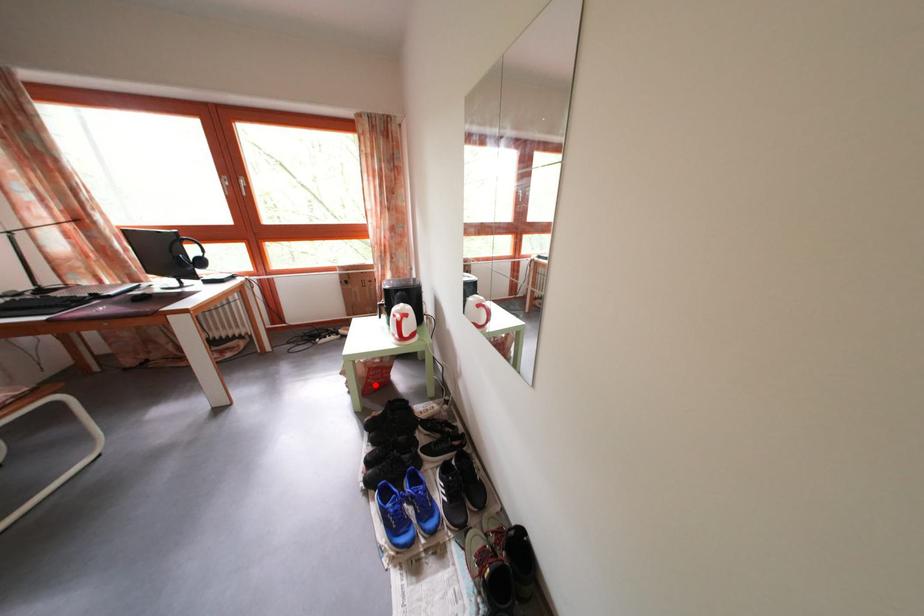
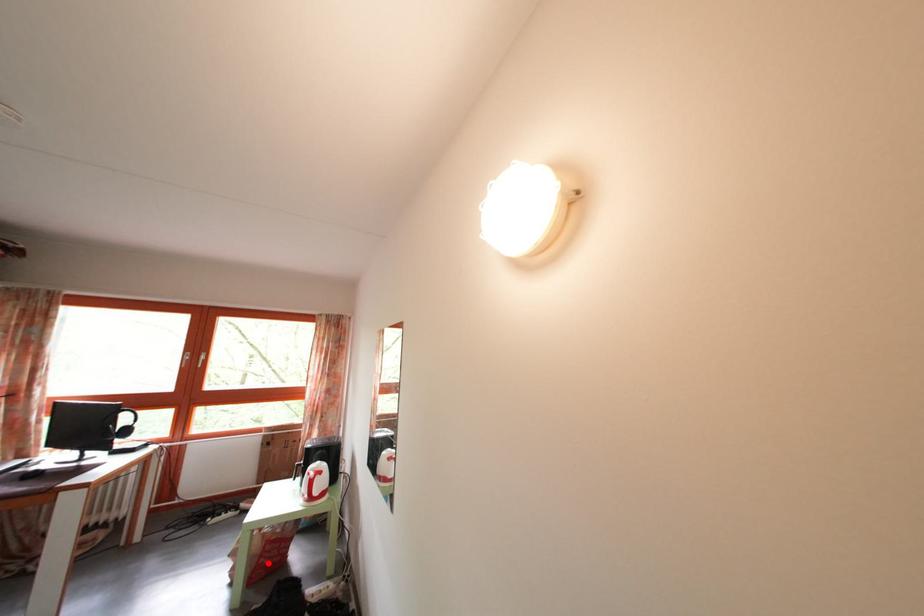
I am providing you with two images of the same scene from different viewpoints. A red point is marked on the first image and another point is marked on the second image. Is the marked point in image1 the same physical position as the marked point in image2?

Yes